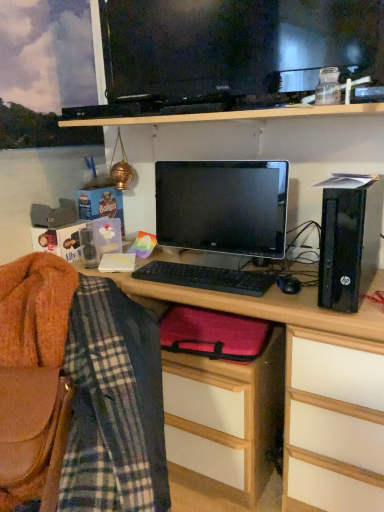
I want to click on free space that is to the left of black plastic computer tower at right, so click(285, 292).